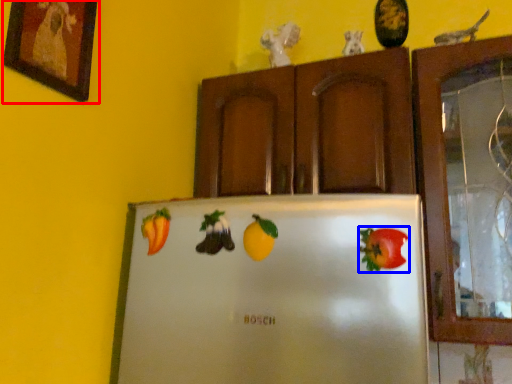
Question: Which object appears farthest to the camera in this image, picture frame (highlighted by a red box) or fruit (highlighted by a blue box)?

Choices:
 (A) picture frame
 (B) fruit

Answer: (B)